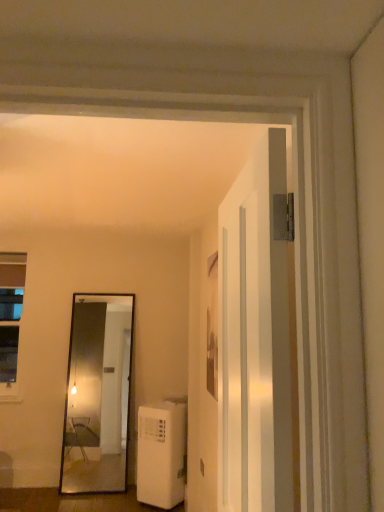
Question: From a real-world perspective, is white plastic air conditioner at lower left positioned over white glossy door at center based on gravity?

Choices:
 (A) yes
 (B) no

Answer: (B)

Question: Does white plastic air conditioner at lower left lie behind white glossy door at center?

Choices:
 (A) no
 (B) yes

Answer: (B)

Question: Considering the relative sizes of white plastic air conditioner at lower left and white glossy door at center in the image provided, is white plastic air conditioner at lower left smaller than white glossy door at center?

Choices:
 (A) no
 (B) yes

Answer: (A)

Question: Is white plastic air conditioner at lower left not within white glossy door at center?

Choices:
 (A) no
 (B) yes

Answer: (B)

Question: Is white plastic air conditioner at lower left looking in the opposite direction of white glossy door at center?

Choices:
 (A) yes
 (B) no

Answer: (B)

Question: Is white plastic air conditioner at lower left placed right next to white glossy door at center?

Choices:
 (A) yes
 (B) no

Answer: (B)

Question: Can you see clear glass window at left touching white plastic air conditioner at lower left?

Choices:
 (A) no
 (B) yes

Answer: (A)

Question: Does clear glass window at left have a smaller size compared to white plastic air conditioner at lower left?

Choices:
 (A) yes
 (B) no

Answer: (A)

Question: Is clear glass window at left to the right of white plastic air conditioner at lower left from the viewer's perspective?

Choices:
 (A) no
 (B) yes

Answer: (A)

Question: Is clear glass window at left in front of white plastic air conditioner at lower left?

Choices:
 (A) yes
 (B) no

Answer: (B)

Question: Does clear glass window at left have a greater height compared to white plastic air conditioner at lower left?

Choices:
 (A) yes
 (B) no

Answer: (A)

Question: Can we say clear glass window at left lies outside white plastic air conditioner at lower left?

Choices:
 (A) no
 (B) yes

Answer: (B)

Question: Is white glossy door at center at the back of clear glass window at left?

Choices:
 (A) yes
 (B) no

Answer: (B)